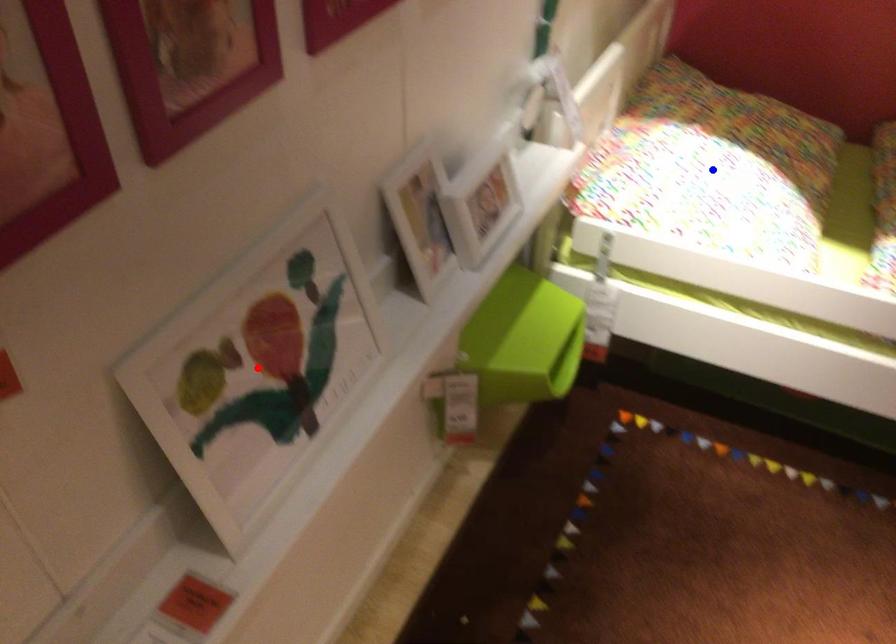
Question: In the image, two points are highlighted. Which point is nearer to the camera? Reply with the corresponding letter.

Choices:
 (A) blue point
 (B) red point

Answer: (B)